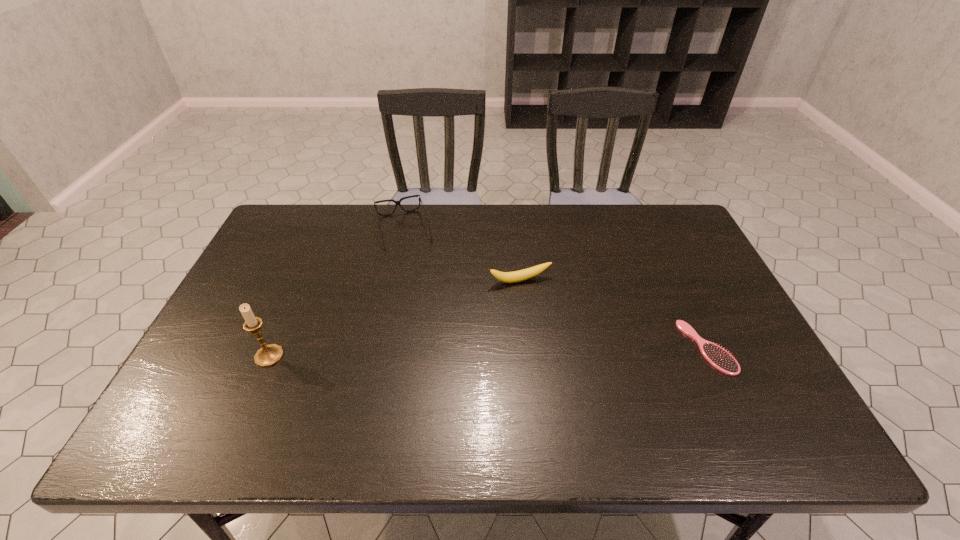
The height and width of the screenshot is (540, 960). Identify the location of free space on the desktop that is between the candle holder and the rightmost object and is positioned on the upward curve of the banana. (551, 350).

Where is `free spot on the desktop that is between the tallest object and the rightmost object and is positioned with the lenses facing outward on the farthest object`? free spot on the desktop that is between the tallest object and the rightmost object and is positioned with the lenses facing outward on the farthest object is located at coordinates (440, 353).